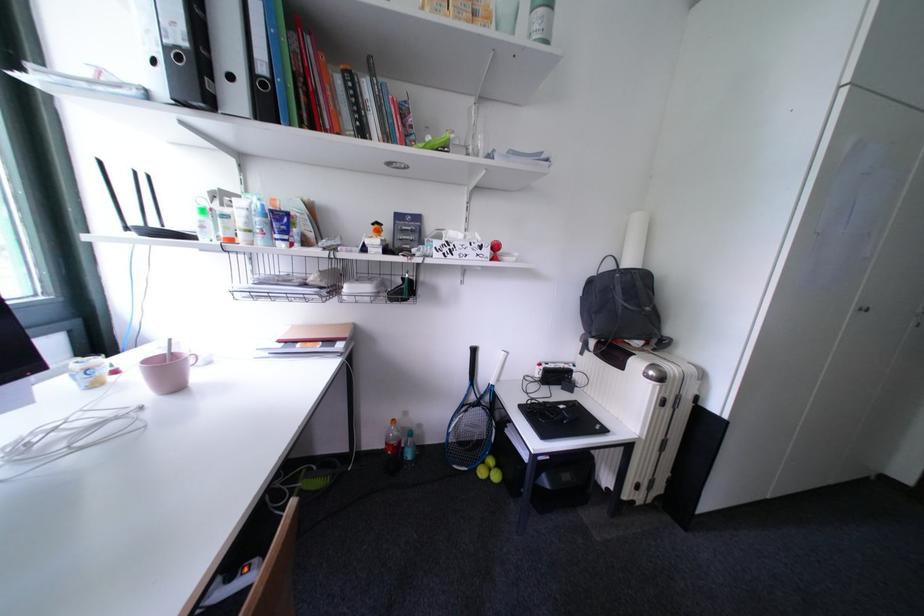
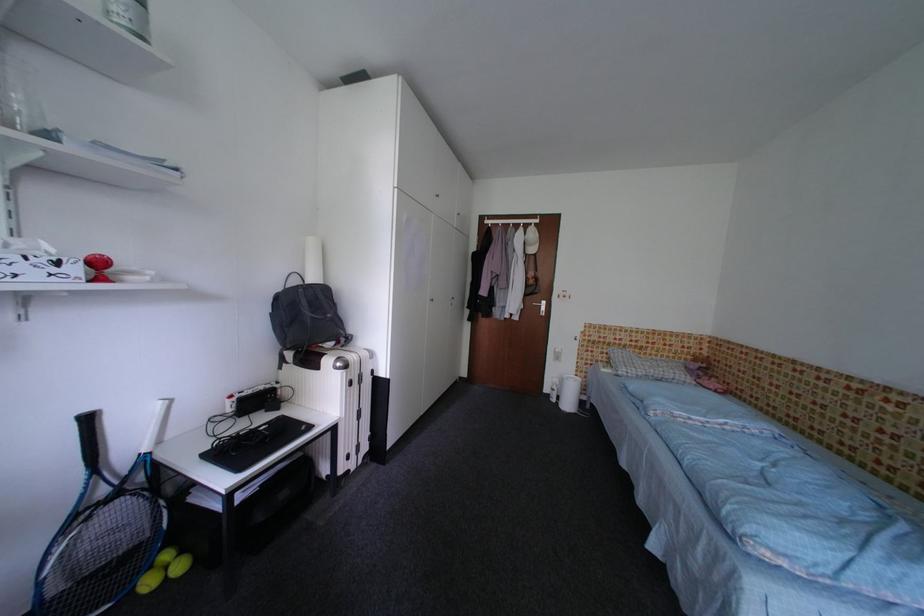
Where in the second image is the point corresponding to pixel 671 405 from the first image?

(359, 386)